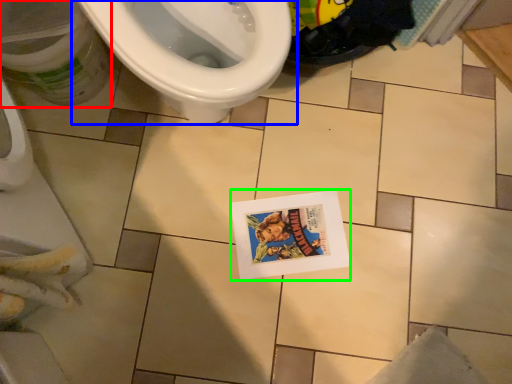
Question: Considering the real-world distances, which object is farthest from potty (highlighted by a red box)? toilet (highlighted by a blue box) or comic book (highlighted by a green box)?

Choices:
 (A) toilet
 (B) comic book

Answer: (B)